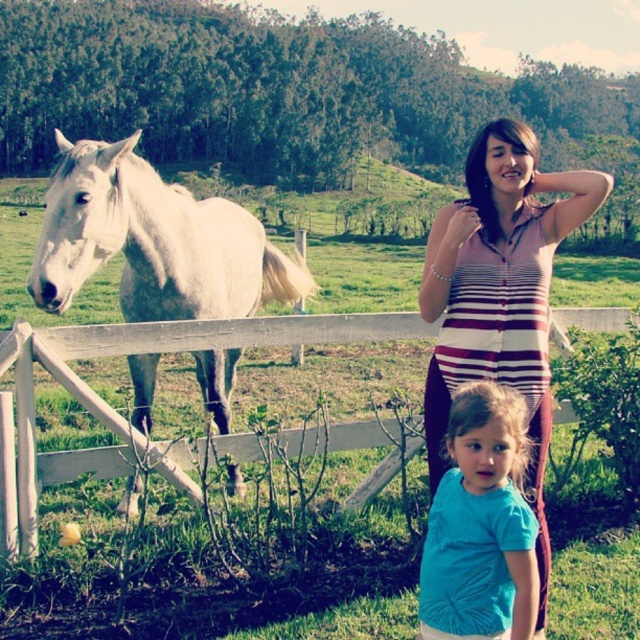
Question: Estimate the real-world distances between objects in this image. Which object is closer to the teal matte shirt at lower right?

Choices:
 (A) white wooden fence at lower center
 (B) striped knit sweater at center

Answer: (B)

Question: Is white matte horse at left below striped knit sweater at center?

Choices:
 (A) no
 (B) yes

Answer: (B)

Question: Which point is closer to the camera?

Choices:
 (A) (456, 552)
 (B) (474, 212)
 (C) (116, 205)
 (D) (76, 467)

Answer: (A)

Question: Is striped knit sweater at center below teal matte shirt at lower right?

Choices:
 (A) no
 (B) yes

Answer: (A)

Question: Estimate the real-world distances between objects in this image. Which object is closer to the white matte horse at left?

Choices:
 (A) teal matte shirt at lower right
 (B) white wooden fence at lower center

Answer: (B)

Question: Does white matte horse at left appear over teal matte shirt at lower right?

Choices:
 (A) no
 (B) yes

Answer: (B)